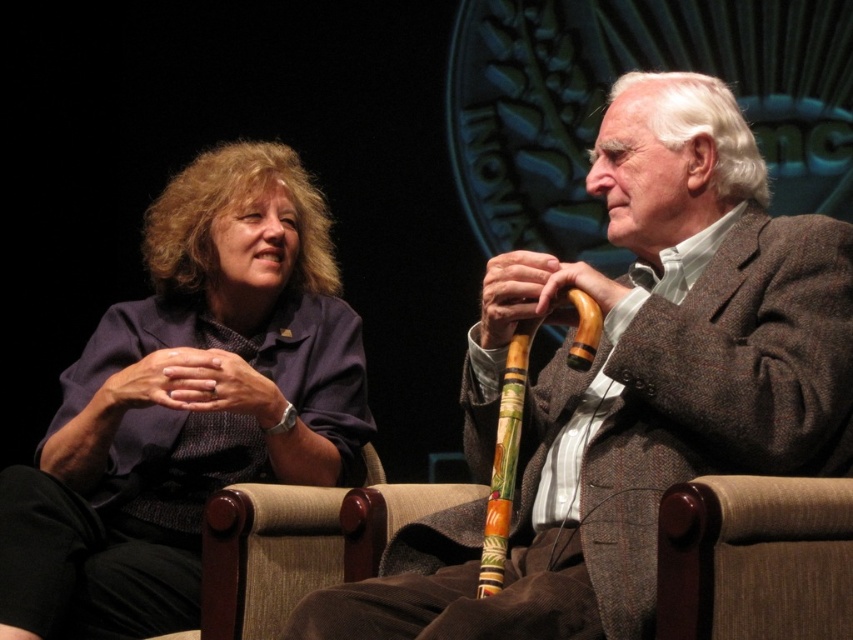
You are an event organizer arranging a photo shoot for the stage setup. You need to ensure that the brown textured cane at center and the matte purple jacket at left are both visible in the frame. Given their sizes, which object might require more strategic placement to avoid being overshadowed?

The brown textured cane at center occupies less space than the matte purple jacket at left, so it might require more strategic placement to avoid being overshadowed by the larger matte purple jacket at left.

You are a stagehand who needs to place a microphone stand exactly 0.1 units to the right of the brown textured cane at center. What coordinates should you set for the microphone stand?

The microphone stand should be placed at coordinates approximately 0.702 on the x and 0.742 on the y, since the brown textured cane at center is at point (631, 385). Adding 0.1 to the x coordinate gives 0.702, while the y coordinate remains unchanged.